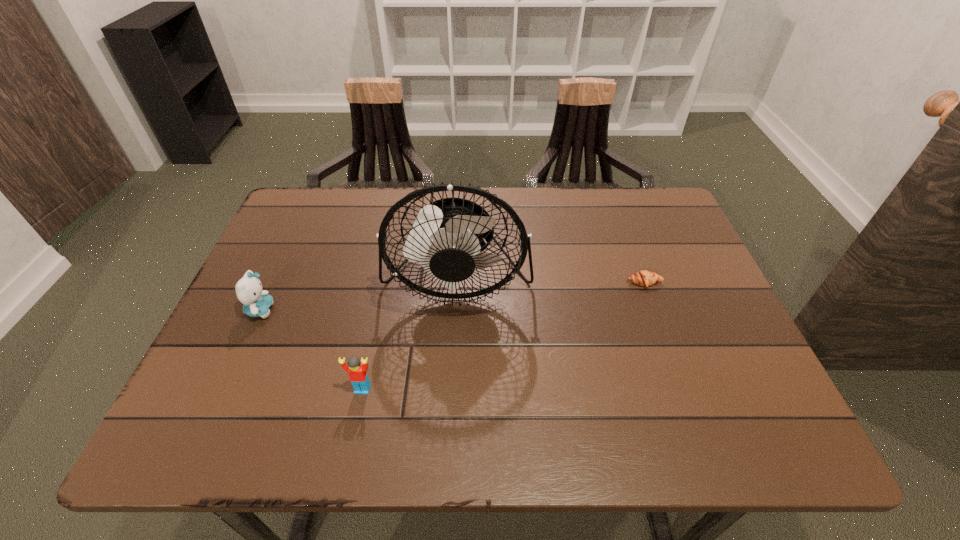
I want to click on object that is at the right edge, so click(644, 278).

This screenshot has width=960, height=540. What are the coordinates of `vacant region at the far edge of the desktop` in the screenshot? It's located at (596, 208).

Locate an element on the screen. This screenshot has height=540, width=960. vacant point at the near edge is located at coordinates point(364,417).

In the image, there is a desktop. Identify the location of blank space at the left edge. (300, 250).

The image size is (960, 540). In the image, there is a desktop. In order to click on vacant area at the far left corner in this screenshot , I will do (320, 188).

This screenshot has height=540, width=960. I want to click on free point between the tallest object and the kitten, so click(359, 294).

Identify the location of vacant area that lies between the Lego and the fan. (410, 334).

What are the coordinates of `vacant space in between the Lego and the fan` in the screenshot? It's located at (410, 334).

Where is `vacant point located between the fan and the leftmost object`? This screenshot has height=540, width=960. vacant point located between the fan and the leftmost object is located at coordinates (359, 294).

Where is `blank region between the nearest object and the fan`? The height and width of the screenshot is (540, 960). blank region between the nearest object and the fan is located at coordinates (410, 334).